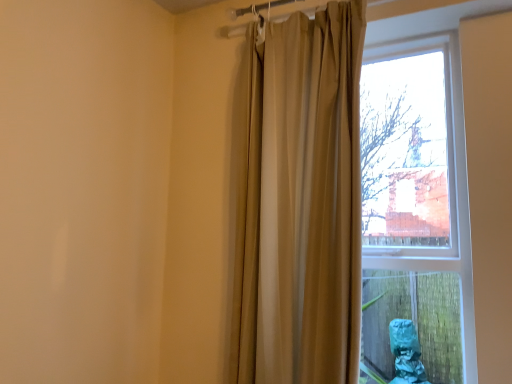
Question: Choose the correct answer: Is matte glass window at center inside beige fabric curtain at center or outside it?

Choices:
 (A) outside
 (B) inside

Answer: (A)

Question: Is matte glass window at center in front of or behind beige fabric curtain at center in the image?

Choices:
 (A) behind
 (B) front

Answer: (B)

Question: From a real-world perspective, is matte glass window at center positioned above or below beige fabric curtain at center?

Choices:
 (A) above
 (B) below

Answer: (B)

Question: Is beige fabric curtain at center taller or shorter than matte glass window at center?

Choices:
 (A) tall
 (B) short

Answer: (A)

Question: Considering the positions of beige fabric curtain at center and matte glass window at center in the image, is beige fabric curtain at center wider or thinner than matte glass window at center?

Choices:
 (A) wide
 (B) thin

Answer: (B)

Question: From a real-world perspective, is beige fabric curtain at center physically located above or below matte glass window at center?

Choices:
 (A) below
 (B) above

Answer: (B)

Question: Is point (339, 375) closer or farther from the camera than point (463, 167)?

Choices:
 (A) farther
 (B) closer

Answer: (B)